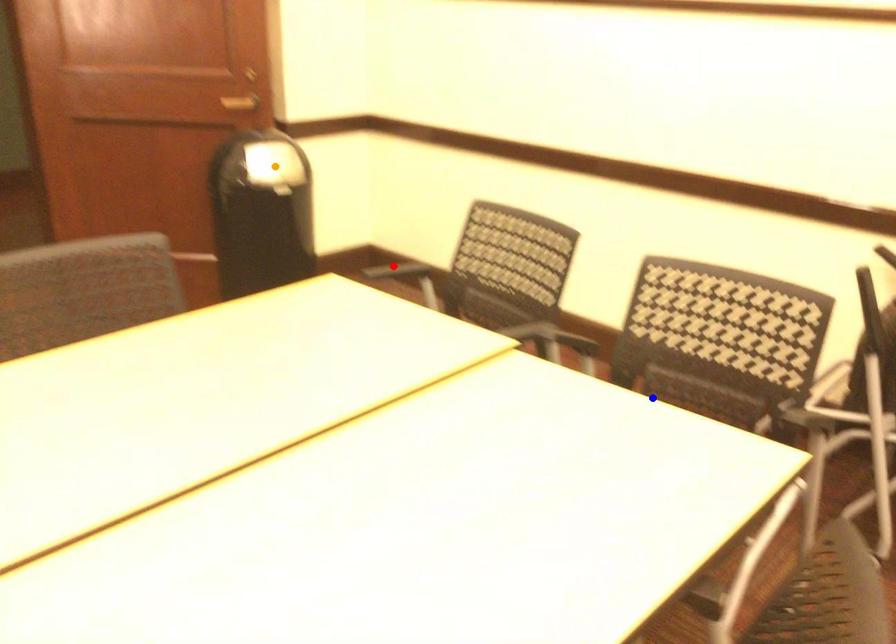
Based on the photo, order these from nearest to farthest:
blue point, red point, orange point

1. blue point
2. orange point
3. red point